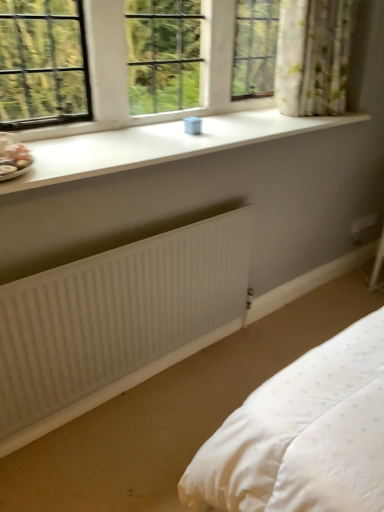
Find the location of a particular element. The height and width of the screenshot is (512, 384). blank area beneath white plastic container at upper center (from a real-world perspective) is located at coordinates (145, 124).